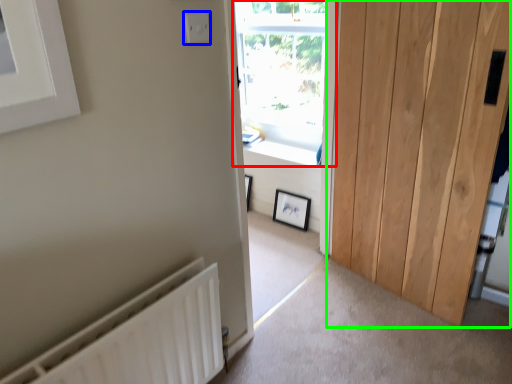
Question: Which object is the farthest from window (highlighted by a red box)? Choose among these: electric outlet (highlighted by a blue box) or door (highlighted by a green box).

Choices:
 (A) electric outlet
 (B) door

Answer: (A)